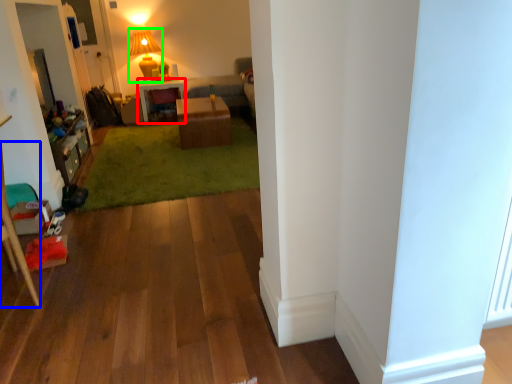
Question: Which is farther away from desk (highlighted by a red box)? furniture (highlighted by a blue box) or lamp (highlighted by a green box)?

Choices:
 (A) furniture
 (B) lamp

Answer: (A)